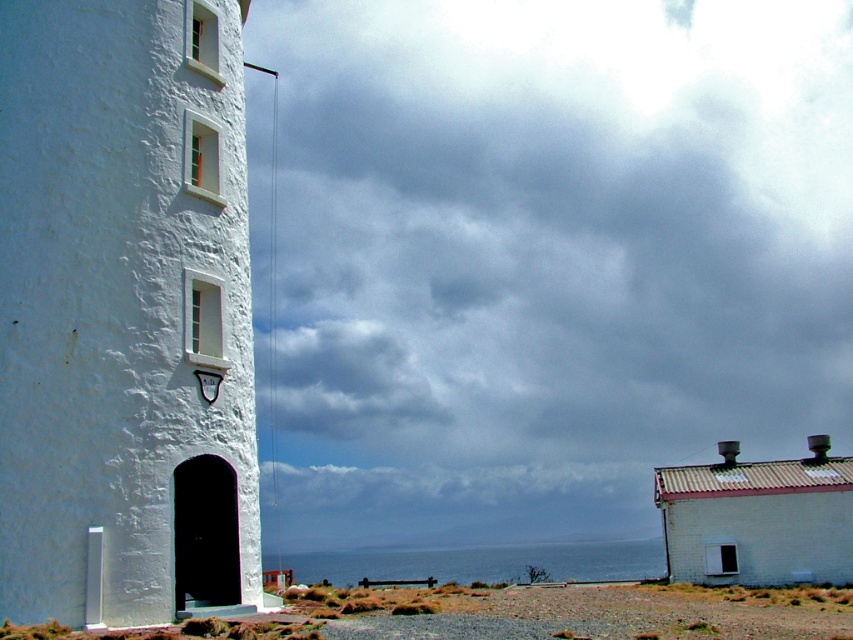
Question: Is cloudy sky at upper center behind white stucco tower at left?

Choices:
 (A) yes
 (B) no

Answer: (A)

Question: Which point appears closest to the camera in this image?

Choices:
 (A) (151, 314)
 (B) (641, 452)

Answer: (A)

Question: Does cloudy sky at upper center have a greater width compared to white stucco tower at left?

Choices:
 (A) yes
 (B) no

Answer: (A)

Question: Is cloudy sky at upper center smaller than white stucco tower at left?

Choices:
 (A) yes
 (B) no

Answer: (B)